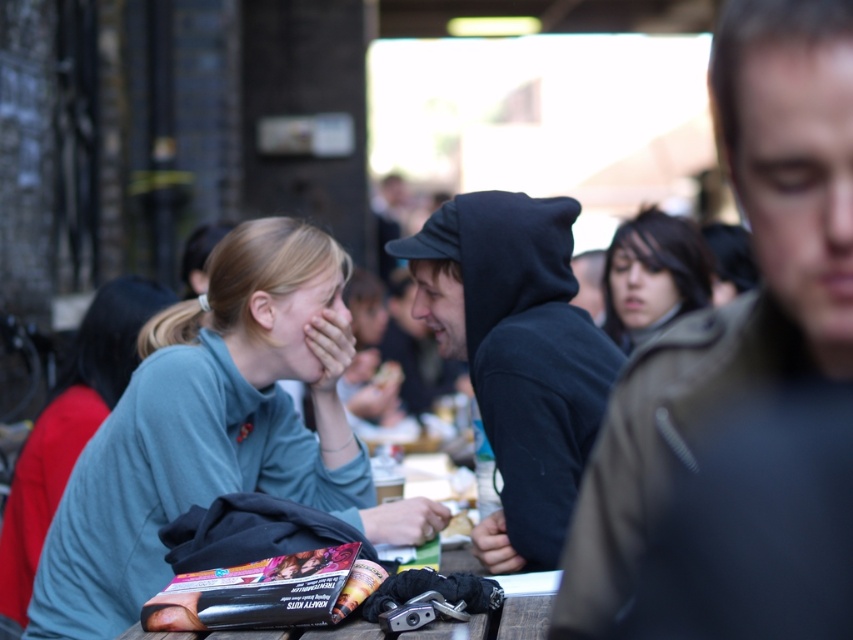
Question: Among these points, which one is nearest to the camera?

Choices:
 (A) (294, 346)
 (B) (740, 397)
 (C) (635, 268)

Answer: (B)

Question: Which point is farther to the camera?

Choices:
 (A) matte green sweater at center
 (B) light blue sweatshirt at left
 (C) black hoodie at center

Answer: (B)

Question: From the image, what is the correct spatial relationship of matte green sweater at center in relation to light blue sweatshirt at left?

Choices:
 (A) above
 (B) below

Answer: (B)

Question: Does black hoodie at center come behind dark brown hair at center?

Choices:
 (A) no
 (B) yes

Answer: (A)

Question: Which point is closer to the camera?

Choices:
 (A) tap(36, 456)
 (B) tap(631, 259)
 (C) tap(721, 323)
 (D) tap(567, 204)

Answer: (C)

Question: Does dark brown leather jacket at right lie behind dark brown hair at center?

Choices:
 (A) no
 (B) yes

Answer: (A)